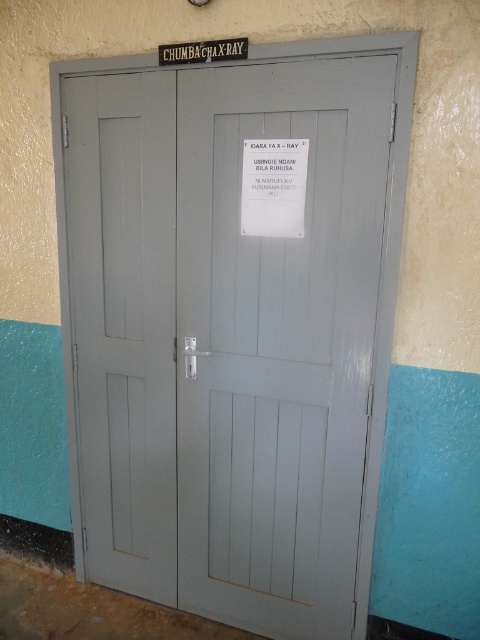
Question: Which object appears closest to the camera in this image?

Choices:
 (A) matte gray door at center
 (B) white paper at center

Answer: (B)

Question: Can you confirm if matte gray door at center is positioned below metallic signboard at upper center?

Choices:
 (A) yes
 (B) no

Answer: (A)

Question: Which point is farther to the camera?

Choices:
 (A) metallic signboard at upper center
 (B) white paper at center

Answer: (B)

Question: Where is painted wood door at center located in relation to matte gray door at center in the image?

Choices:
 (A) left
 (B) right

Answer: (B)

Question: Which point is farther from the camera taking this photo?

Choices:
 (A) (173, 476)
 (B) (304, 180)
 (C) (217, 56)
 (D) (388, 337)

Answer: (A)

Question: From the image, what is the correct spatial relationship of matte gray door at center in relation to metallic signboard at upper center?

Choices:
 (A) left
 (B) right

Answer: (A)